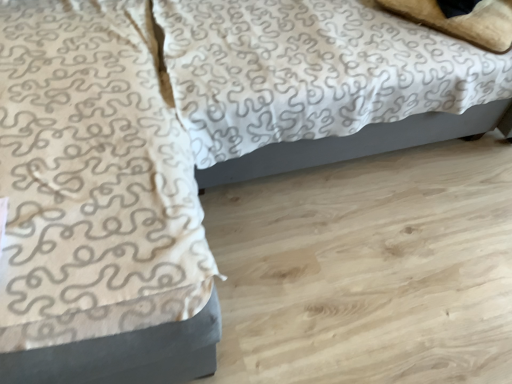
Question: In terms of size, does white textured fabric at center appear bigger or smaller than white textured blanket at upper left?

Choices:
 (A) small
 (B) big

Answer: (B)

Question: From a real-world perspective, is white textured fabric at center physically located above or below white textured blanket at upper left?

Choices:
 (A) above
 (B) below

Answer: (A)

Question: Considering the real-world distances, which object is farthest from the beige soft pillow at upper right?

Choices:
 (A) white textured blanket at upper left
 (B) white textured fabric at center

Answer: (A)

Question: Estimate the real-world distances between objects in this image. Which object is farther from the beige soft pillow at upper right?

Choices:
 (A) white textured fabric at center
 (B) white textured blanket at upper left

Answer: (B)